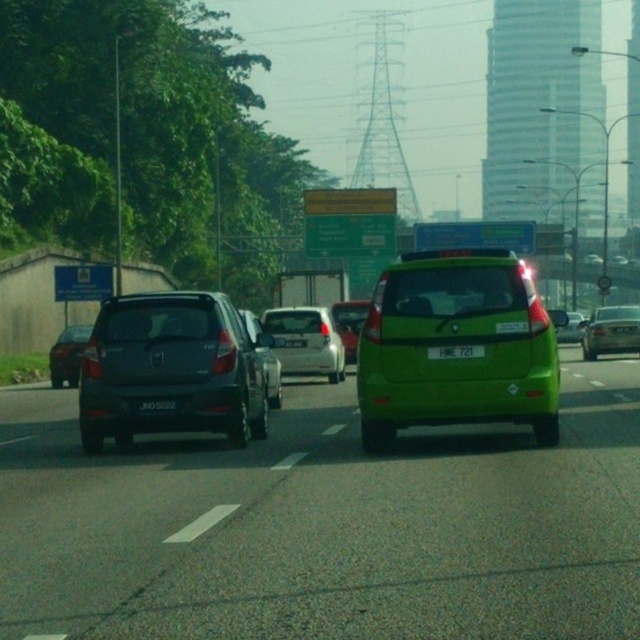
Question: Is green matte taxi at center above matte white sedan at center?

Choices:
 (A) yes
 (B) no

Answer: (B)

Question: Is metallic silver sedan at right below black plastic license plate at center?

Choices:
 (A) yes
 (B) no

Answer: (B)

Question: Can you confirm if matte black hatchback at left is positioned below green matte van at center?

Choices:
 (A) yes
 (B) no

Answer: (B)

Question: Which point is farther to the camera?

Choices:
 (A) green matte taxi at center
 (B) white plastic license plate at center

Answer: (B)

Question: Which object is the farthest from the green matte hatchback at center?

Choices:
 (A) shiny silver sedan at center
 (B) matte black suv at left

Answer: (A)

Question: Which object is positioned closest to the green matte taxi at center?

Choices:
 (A) metallic silver sedan at right
 (B) shiny silver sedan at center
 (C) green matte car at center
 (D) green matte van at center

Answer: (C)